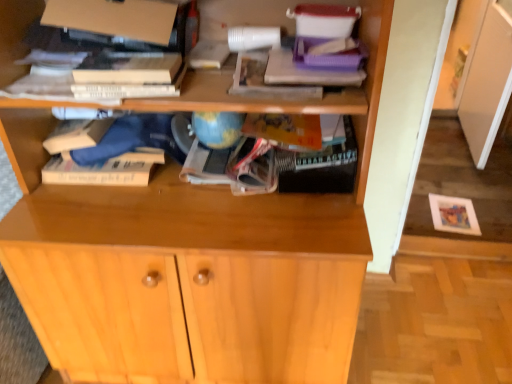
Question: Visually, is hardcover book at upper center positioned to the left or to the right of light wood cabinet at center?

Choices:
 (A) left
 (B) right

Answer: (A)

Question: In terms of size, does hardcover book at upper center appear bigger or smaller than light wood cabinet at center?

Choices:
 (A) big
 (B) small

Answer: (B)

Question: Considering the positions of hardcover book at upper center and light wood cabinet at center in the image, is hardcover book at upper center wider or thinner than light wood cabinet at center?

Choices:
 (A) wide
 (B) thin

Answer: (B)

Question: Based on their sizes in the image, would you say light wood cabinet at center is bigger or smaller than hardcover book at upper center?

Choices:
 (A) small
 (B) big

Answer: (B)

Question: Is point (201, 352) positioned closer to the camera than point (108, 72)?

Choices:
 (A) closer
 (B) farther

Answer: (B)

Question: From a real-world perspective, is light wood cabinet at center positioned above or below hardcover book at upper center?

Choices:
 (A) above
 (B) below

Answer: (B)

Question: Is light wood cabinet at center in front of or behind hardcover book at upper center in the image?

Choices:
 (A) behind
 (B) front

Answer: (A)